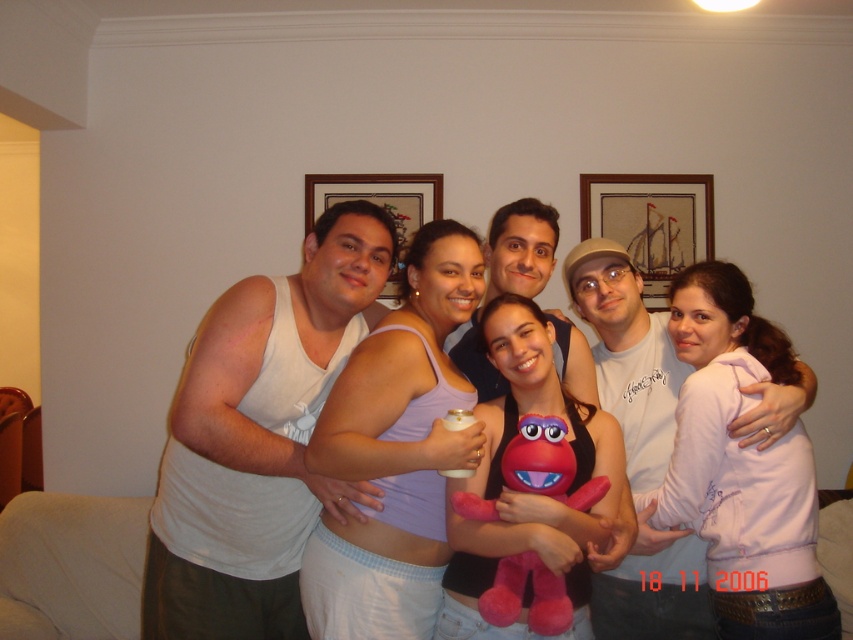
You are taking a photo of a group of people in a living room. You want to focus on the person at point (601,608) and the person at point (321,198). Which of these two points is closer to the camera?

Point (601,608) is closer to the camera than point (321,198).

From the picture: You are a photographer trying to capture a candid shot of the matte white tank top at center and the brushed metal picture frame at upper center. Since you want both subjects in the frame, which one should you position closer to the left side of your camera viewfinder?

The brushed metal picture frame at upper center should be positioned closer to the left side of the camera viewfinder because the matte white tank top at center is to the right of it.

In the scene shown: You are a photographer trying to capture a photo of the group. You notice the white matte tank top at center and the wooden framed picture at upper center. Which object should you focus on first to ensure it appears larger in the final image?

The white matte tank top at center is taller than the wooden framed picture at upper center, so focusing on it first will ensure it appears larger in the final image.